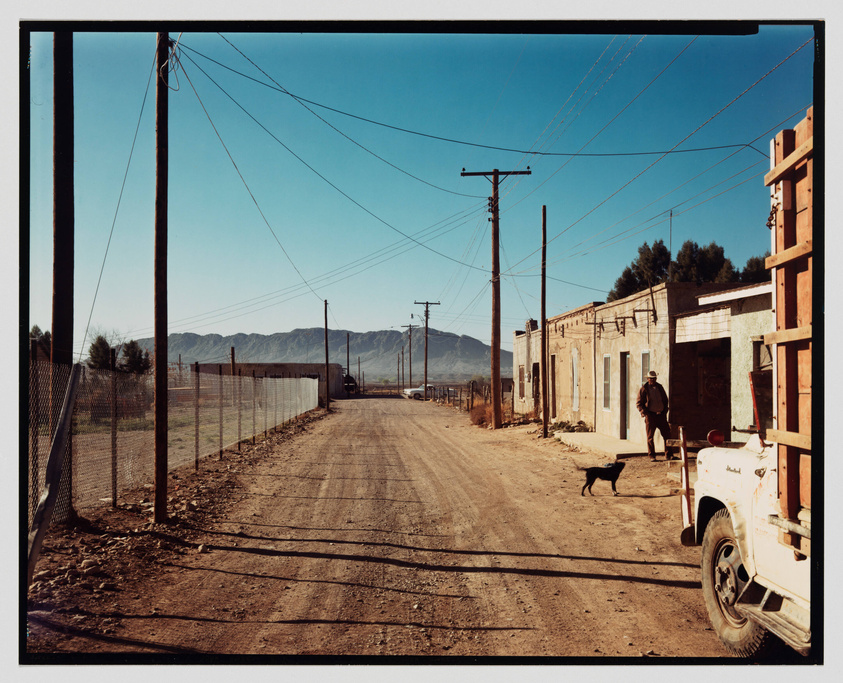
Locate an element on the screen. cable is located at coordinates (583, 143).